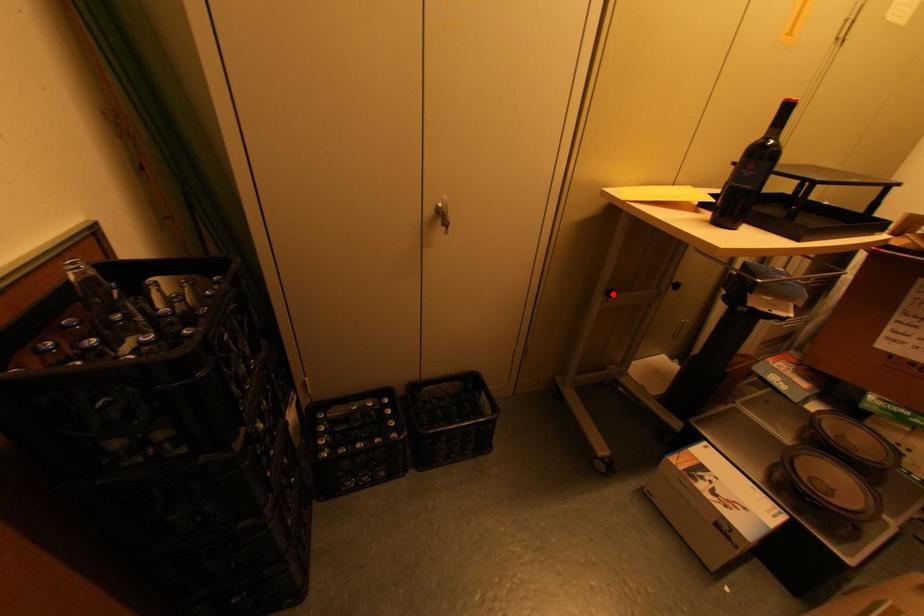
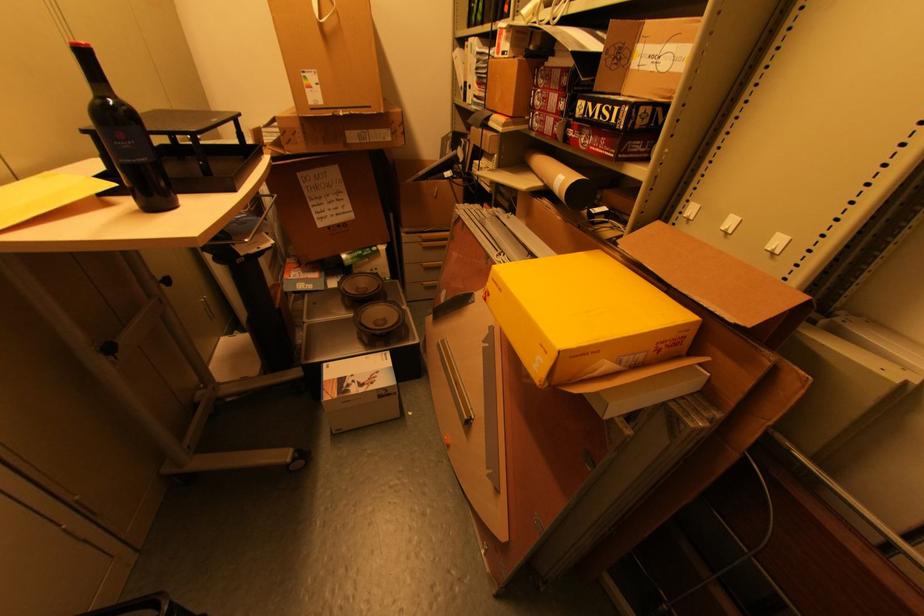
In the second image, find the point that corresponds to the highlighted location in the first image.

(114, 349)